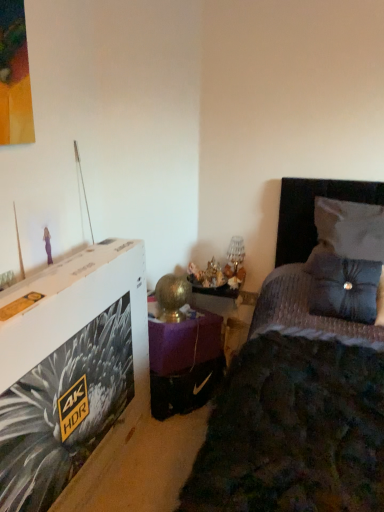
Question: Would you say velvet dark blue bed at center contains purple velvet table at center?

Choices:
 (A) no
 (B) yes

Answer: (A)

Question: Can you confirm if velvet dark blue bed at center is smaller than purple velvet table at center?

Choices:
 (A) yes
 (B) no

Answer: (B)

Question: Is velvet dark blue bed at center shorter than purple velvet table at center?

Choices:
 (A) yes
 (B) no

Answer: (B)

Question: Can you confirm if velvet dark blue bed at center is bigger than purple velvet table at center?

Choices:
 (A) yes
 (B) no

Answer: (A)

Question: Is velvet dark blue bed at center not near purple velvet table at center?

Choices:
 (A) yes
 (B) no

Answer: (B)

Question: Does velvet dark blue bed at center have a greater width compared to purple velvet table at center?

Choices:
 (A) yes
 (B) no

Answer: (A)

Question: Is velvet dark blue bed at center at the left side of white fabric pillow at upper right, the second pillow in the bottom-to-top sequence?

Choices:
 (A) yes
 (B) no

Answer: (A)

Question: Is velvet dark blue bed at center smaller than white fabric pillow at upper right, the second pillow in the bottom-to-top sequence?

Choices:
 (A) yes
 (B) no

Answer: (B)

Question: Is velvet dark blue bed at center to the right of white fabric pillow at upper right, arranged as the first pillow when viewed from the top, from the viewer's perspective?

Choices:
 (A) no
 (B) yes

Answer: (A)

Question: Does velvet dark blue bed at center have a lesser height compared to white fabric pillow at upper right, the second pillow in the bottom-to-top sequence?

Choices:
 (A) no
 (B) yes

Answer: (A)

Question: From the image's perspective, does velvet dark blue bed at center appear lower than white fabric pillow at upper right, arranged as the first pillow when viewed from the top?

Choices:
 (A) yes
 (B) no

Answer: (A)

Question: Is velvet dark blue bed at center further to camera compared to white fabric pillow at upper right, the second pillow in the bottom-to-top sequence?

Choices:
 (A) no
 (B) yes

Answer: (A)

Question: Considering the relative sizes of white fabric pillow at upper right, arranged as the first pillow when viewed from the top, and satin blue pillow at right, arranged as the 1th pillow when ordered from the bottom, in the image provided, is white fabric pillow at upper right, arranged as the first pillow when viewed from the top, thinner than satin blue pillow at right, arranged as the 1th pillow when ordered from the bottom,?

Choices:
 (A) yes
 (B) no

Answer: (B)